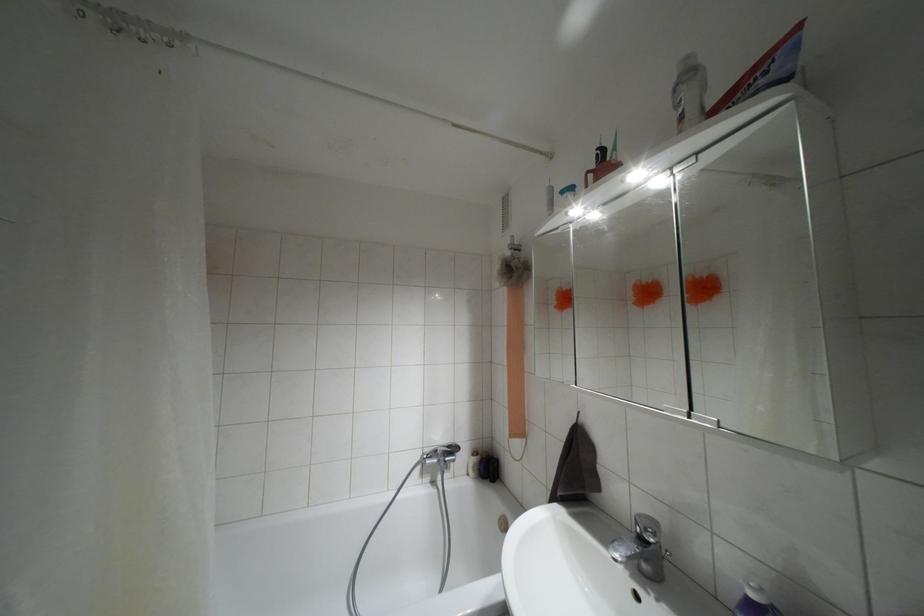
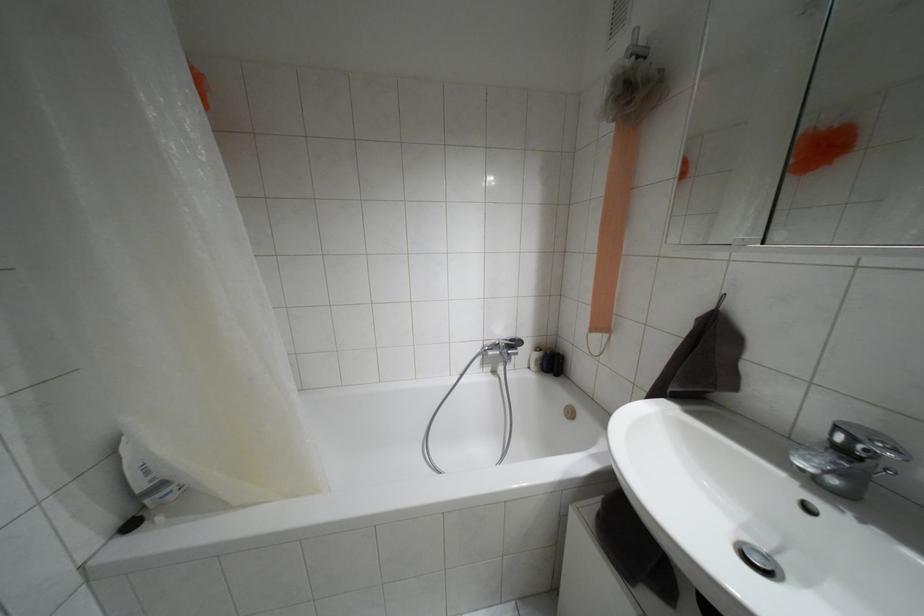
The images are taken continuously from a first-person perspective. In which direction are you moving?

The cameraman walked toward left, forward.